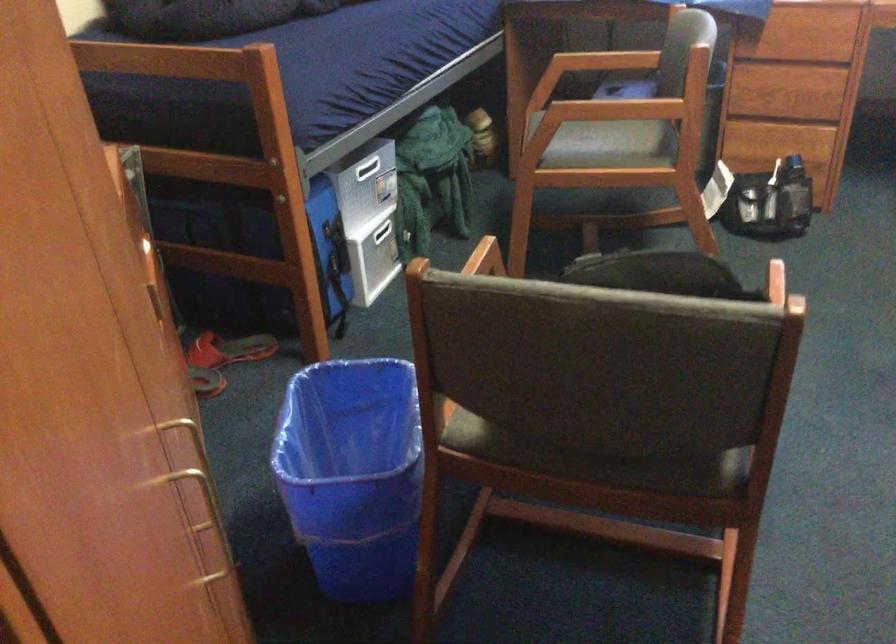
Find where to grip the chair armrest. Please return your answer as a coordinate pair (x, y).

(487, 257)